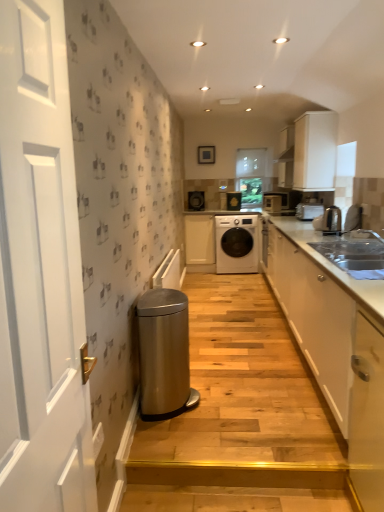
This screenshot has height=512, width=384. I want to click on vacant point above stainless steel trash can at lower left, marked as the 1th stairwell in a back-to-front arrangement (from a real-world perspective), so click(235, 346).